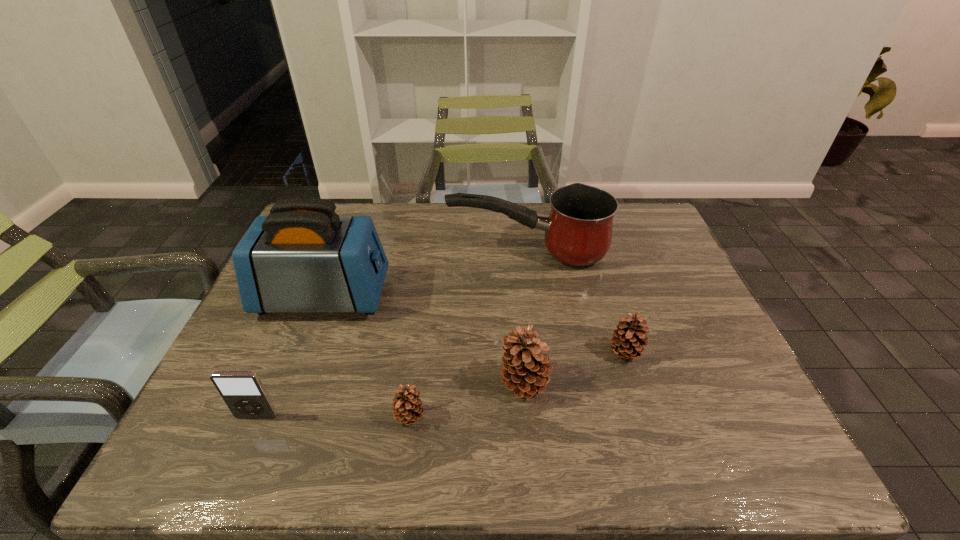
Find the location of a particular element. free space at the far edge of the desktop is located at coordinates (463, 224).

In the image, there is a desktop. At what (x,y) coordinates should I click in order to perform the action: click on blank space at the near edge. Please return your answer as a coordinate pair (x, y). Looking at the image, I should click on (501, 396).

At what (x,y) coordinates should I click in order to perform the action: click on vacant area at the left edge. Please return your answer as a coordinate pair (x, y). Looking at the image, I should click on (240, 339).

Locate an element on the screen. The width and height of the screenshot is (960, 540). vacant space at the right edge of the desktop is located at coordinates (647, 291).

In the image, there is a desktop. Where is `vacant space at the near right corner`? vacant space at the near right corner is located at coordinates (722, 413).

Where is `vacant area between the iPod and the second pinecone from right to left`? This screenshot has height=540, width=960. vacant area between the iPod and the second pinecone from right to left is located at coordinates (391, 400).

You are a GUI agent. You are given a task and a screenshot of the screen. Output one action in this format:
    pyautogui.click(x=<x>, y=<y>)
    Task: Click on the free area in between the saucepan and the iPod
    The height and width of the screenshot is (540, 960).
    Given the screenshot: What is the action you would take?
    pyautogui.click(x=392, y=334)

Where is `vacant region between the shortest object and the saucepan`? vacant region between the shortest object and the saucepan is located at coordinates coord(468,334).

You are a GUI agent. You are given a task and a screenshot of the screen. Output one action in this format:
    pyautogui.click(x=<x>, y=<y>)
    Task: Click on the free spot between the toaster and the fourth object from right to left
    This screenshot has height=540, width=960.
    Given the screenshot: What is the action you would take?
    pyautogui.click(x=367, y=356)

This screenshot has width=960, height=540. What are the coordinates of `vacant area between the iPod and the saucepan` in the screenshot? It's located at (392, 334).